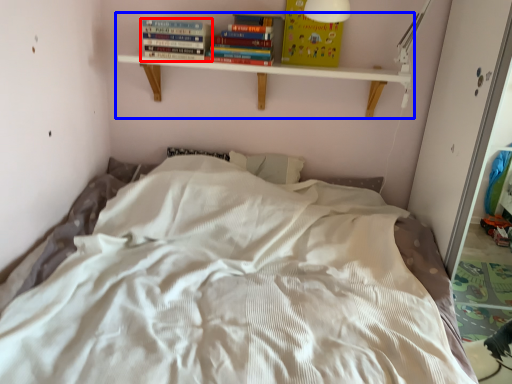
Question: Among these objects, which one is nearest to the camera, book (highlighted by a red box) or shelf (highlighted by a blue box)?

Choices:
 (A) book
 (B) shelf

Answer: (B)